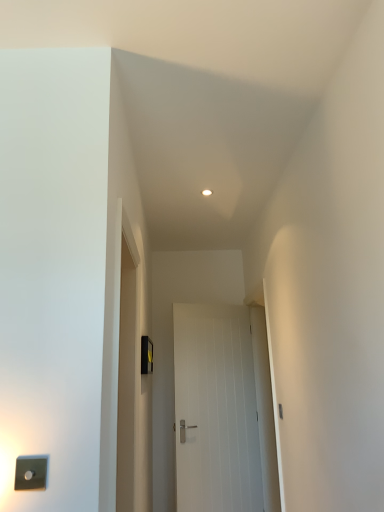
Question: Can you confirm if black plastic light switch at center, the first light switch when ordered from right to left, is smaller than white smooth door at center?

Choices:
 (A) yes
 (B) no

Answer: (A)

Question: From the image's perspective, is black plastic light switch at center, which is counted as the 2th light switch, starting from the left, over white smooth door at center?

Choices:
 (A) yes
 (B) no

Answer: (A)

Question: Can you confirm if black plastic light switch at center, which is counted as the 2th light switch, starting from the left, is positioned to the left of white smooth door at center?

Choices:
 (A) yes
 (B) no

Answer: (A)

Question: Is black plastic light switch at center, placed as the 1th light switch when sorted from back to front, positioned before white smooth door at center?

Choices:
 (A) yes
 (B) no

Answer: (A)

Question: Is black plastic light switch at center, which is counted as the 2th light switch, starting from the left, completely or partially outside of white smooth door at center?

Choices:
 (A) yes
 (B) no

Answer: (A)

Question: Is black plastic light switch at center, the 2th light switch when ordered from front to back, aimed at white smooth door at center?

Choices:
 (A) yes
 (B) no

Answer: (B)

Question: Could you tell me if white smooth door at center is facing black plastic light switch at center, the first light switch when ordered from right to left?

Choices:
 (A) no
 (B) yes

Answer: (A)

Question: Does white smooth door at center have a smaller size compared to black plastic light switch at center, the 2th light switch when ordered from front to back?

Choices:
 (A) no
 (B) yes

Answer: (A)

Question: Is white smooth door at center not near black plastic light switch at center, the first light switch when ordered from right to left?

Choices:
 (A) no
 (B) yes

Answer: (A)

Question: Could black plastic light switch at center, the first light switch when ordered from right to left, be considered to be inside white smooth door at center?

Choices:
 (A) yes
 (B) no

Answer: (B)

Question: From the image's perspective, is white smooth door at center beneath black plastic light switch at center, the 2th light switch when ordered from front to back?

Choices:
 (A) no
 (B) yes

Answer: (B)

Question: Does white smooth door at center have a larger size compared to black plastic light switch at center, the first light switch when ordered from right to left?

Choices:
 (A) yes
 (B) no

Answer: (A)

Question: Is satin silver switch at lower left, positioned as the 2th light switch in back-to-front order, aimed at white smooth door at center?

Choices:
 (A) no
 (B) yes

Answer: (A)